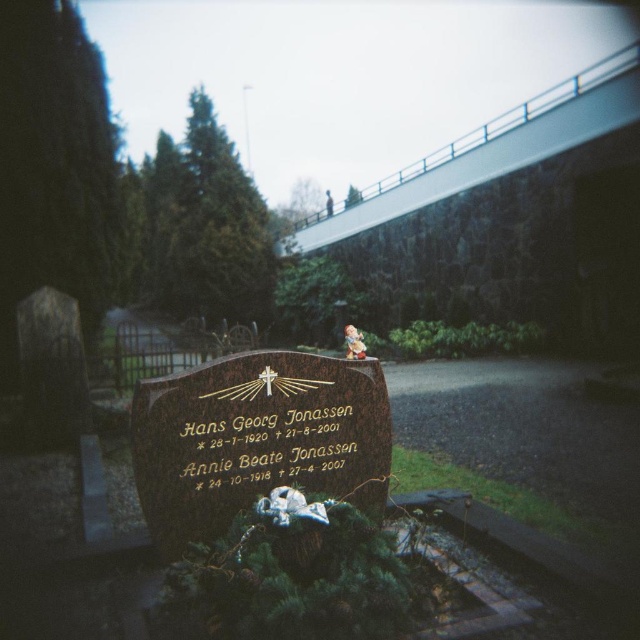
Does brown polished stone gravestone at center have a lesser height compared to matte ceramic figurine at center?

No, brown polished stone gravestone at center is not shorter than matte ceramic figurine at center.

Who is shorter, brown polished stone gravestone at center or matte ceramic figurine at center?

With less height is matte ceramic figurine at center.

The width and height of the screenshot is (640, 640). I want to click on brown polished stone gravestone at center, so click(x=256, y=438).

Find the location of a particular element. brown polished stone gravestone at center is located at coordinates (256, 438).

Does white concrete overpass at upper center have a larger size compared to matte ceramic figurine at center?

Yes.

Is white concrete overpass at upper center shorter than matte ceramic figurine at center?

Incorrect, white concrete overpass at upper center's height does not fall short of matte ceramic figurine at center's.

Which is in front, point (522, 113) or point (356, 337)?

Positioned in front is point (356, 337).

Locate an element on the screen. white concrete overpass at upper center is located at coordinates pyautogui.click(x=486, y=150).

Between point (272, 445) and point (602, 99), which one is positioned behind?

The point (602, 99) is behind.

Is point (156, 436) farther from camera compared to point (336, 225)?

No.

This screenshot has height=640, width=640. I want to click on brown polished stone gravestone at center, so click(x=256, y=438).